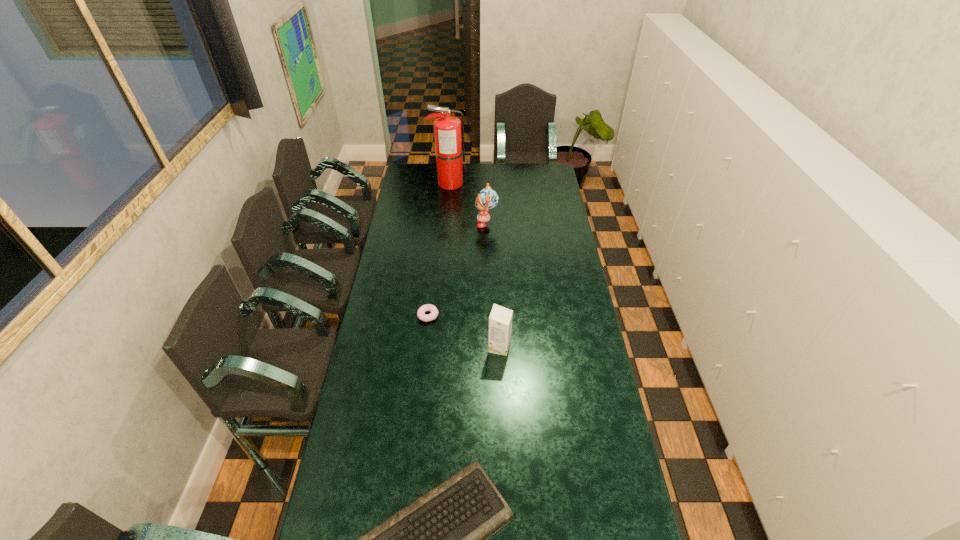
In order to click on fire extinguisher in this screenshot , I will do `click(449, 142)`.

Where is `the tallest object`? the tallest object is located at coordinates (449, 142).

I want to click on doll, so click(487, 199).

Where is `carton`? Image resolution: width=960 pixels, height=540 pixels. carton is located at coordinates (500, 320).

The image size is (960, 540). Find the location of `the third nearest object`. the third nearest object is located at coordinates (421, 315).

I want to click on the shortest object, so click(x=421, y=315).

The width and height of the screenshot is (960, 540). Find the location of `vacant position located 0.180m at the nozzle of the farthest object`. vacant position located 0.180m at the nozzle of the farthest object is located at coordinates (498, 184).

You are a GUI agent. You are given a task and a screenshot of the screen. Output one action in this format:
    pyautogui.click(x=<x>, y=<y>)
    Task: Click on the free space located 0.070m on the face of the doll
    
    Given the screenshot: What is the action you would take?
    463,224

This screenshot has height=540, width=960. What are the coordinates of `blank space located 0.200m on the face of the doll` in the screenshot? It's located at (438, 224).

At what (x,y) coordinates should I click in order to perform the action: click on free space located on the face of the doll. Please return your answer as a coordinate pair (x, y). Looking at the image, I should click on (465, 224).